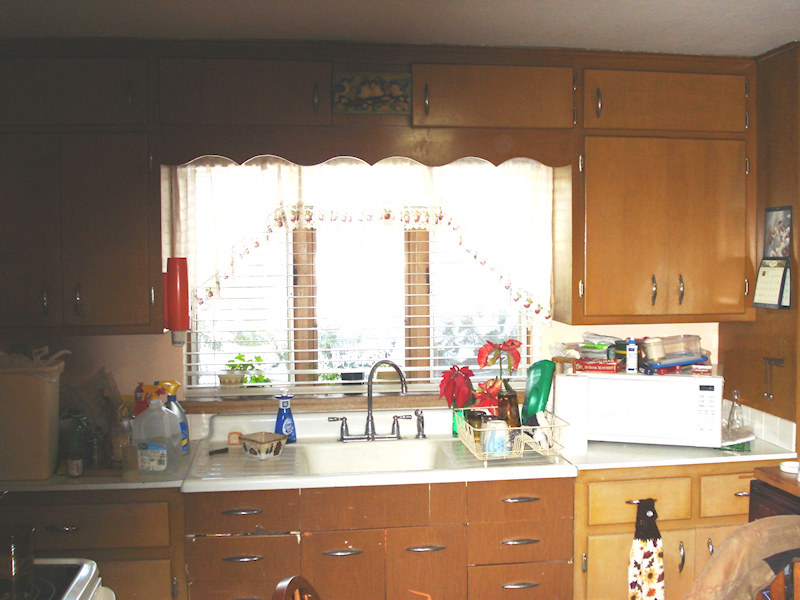
Where is `top of chair backs`? top of chair backs is located at coordinates (288, 584), (778, 523).